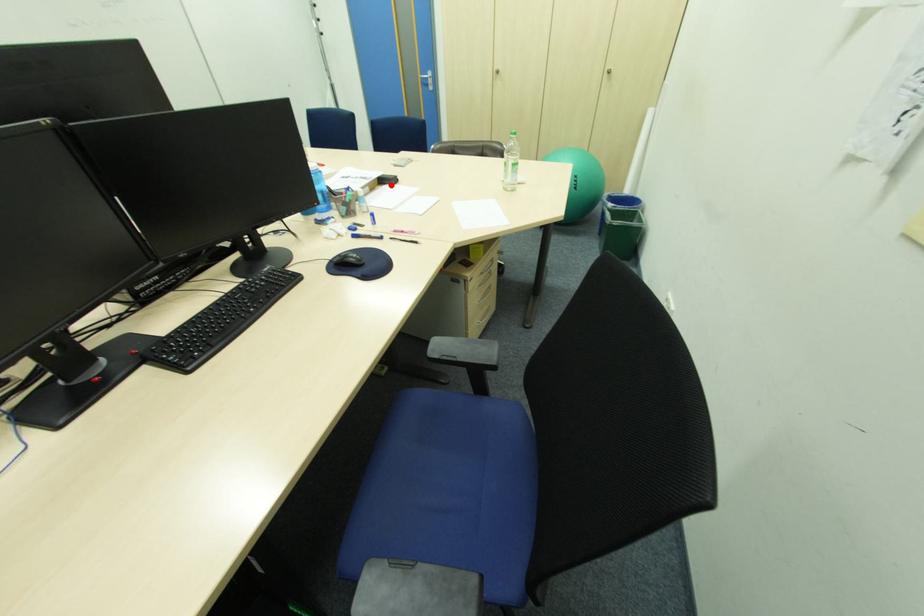
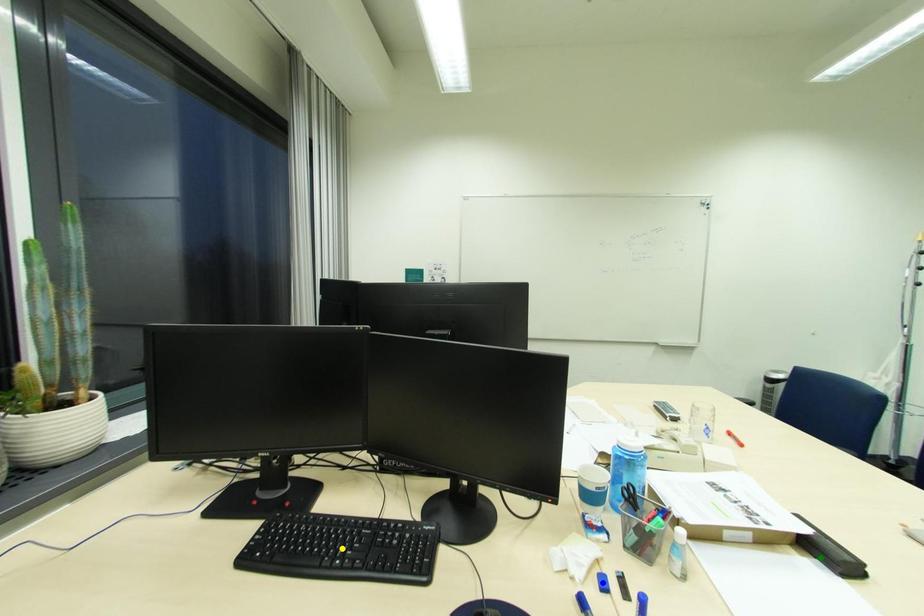
Question: I am providing you with two images of the same scene from different viewpoints. A red point is marked on the first image. You are given multiple points on the second image. Which spot in image 2 lines up with the point in image 1?

Choices:
 (A) yellow point
 (B) green point
 (C) blue point

Answer: (B)